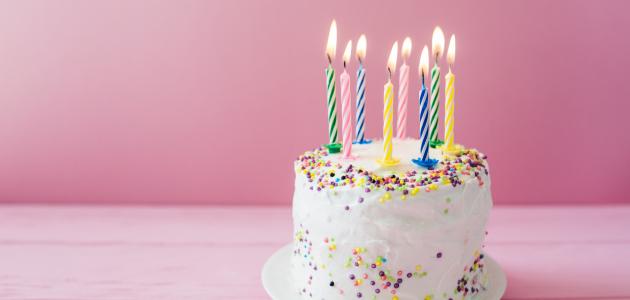
Locate an element on the screen. The image size is (630, 300). plastic birthday candle holder is located at coordinates (333, 148), (361, 139), (401, 139), (433, 139), (445, 146), (428, 162), (392, 162), (352, 157).